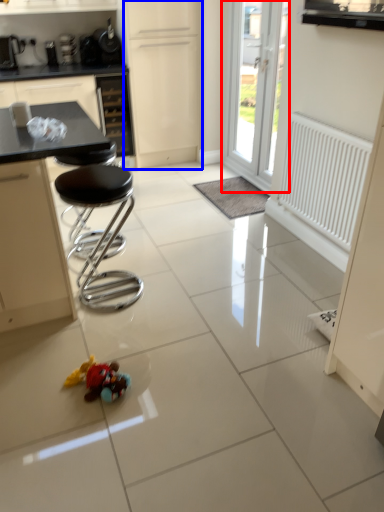
Question: Among these objects, which one is farthest to the camera, door (highlighted by a red box) or screen door (highlighted by a blue box)?

Choices:
 (A) door
 (B) screen door

Answer: (B)